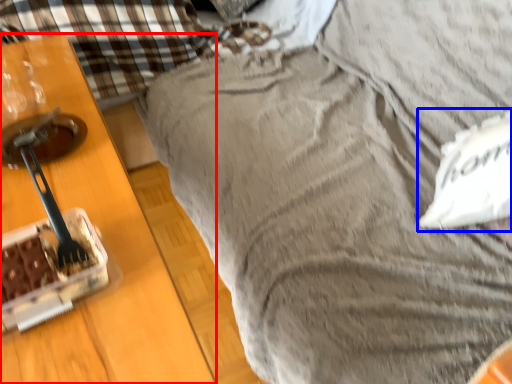
Question: Which of the following is the farthest to the observer, furniture (highlighted by a red box) or pillow (highlighted by a blue box)?

Choices:
 (A) furniture
 (B) pillow

Answer: (B)